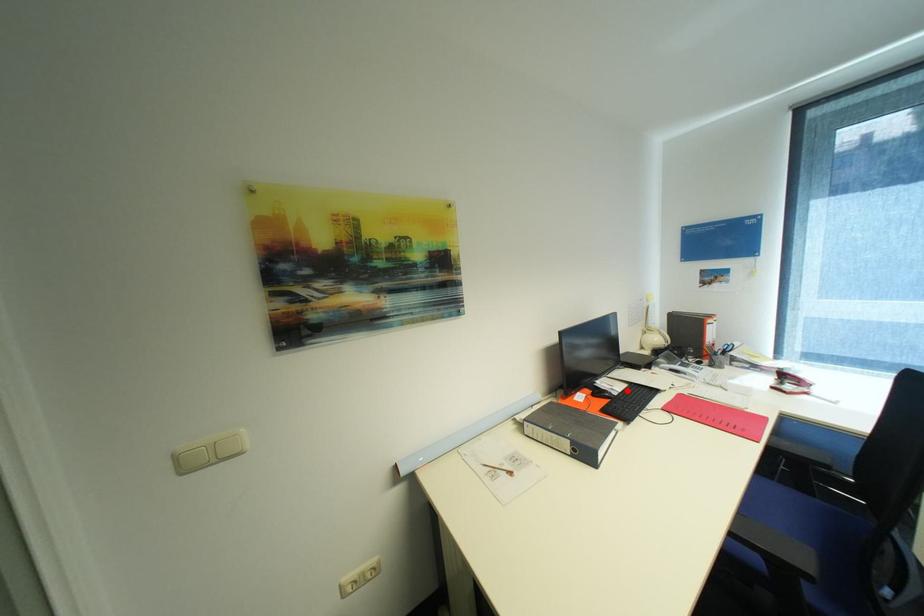
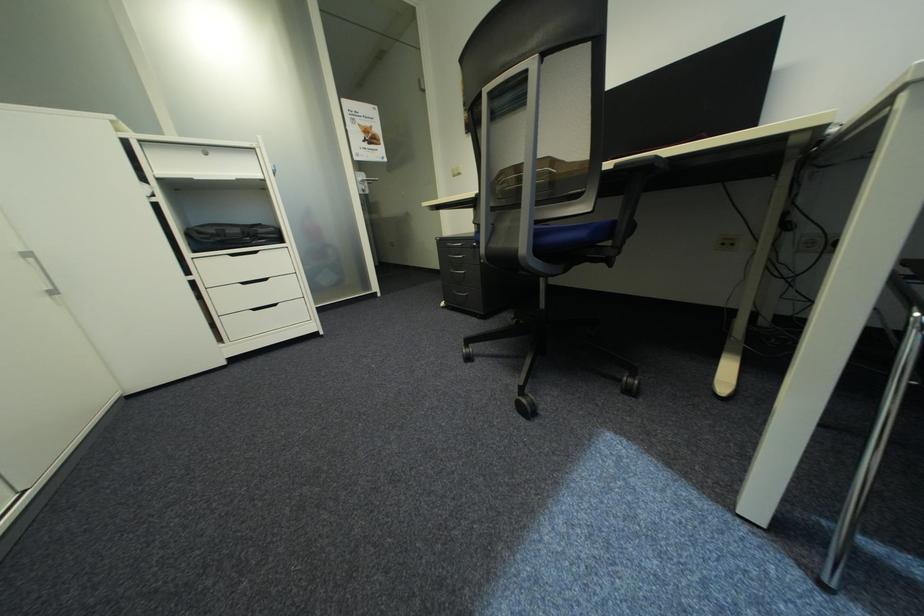
Question: I am providing you with two images of the same scene from different viewpoints. A red point is marked on the first image. Can you still see the location of the red point in image 2?

Choices:
 (A) Yes
 (B) No

Answer: (B)